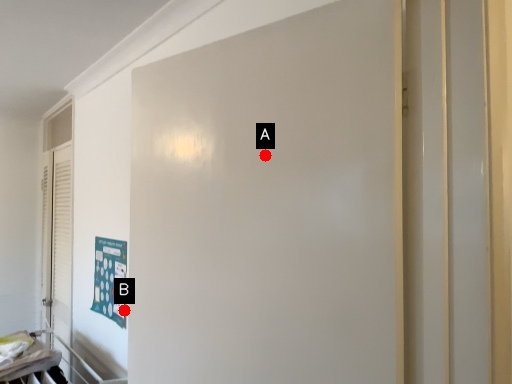
Question: Two points are circled on the image, labeled by A and B beside each circle. Which point is closer to the camera?

Choices:
 (A) A is closer
 (B) B is closer

Answer: (A)